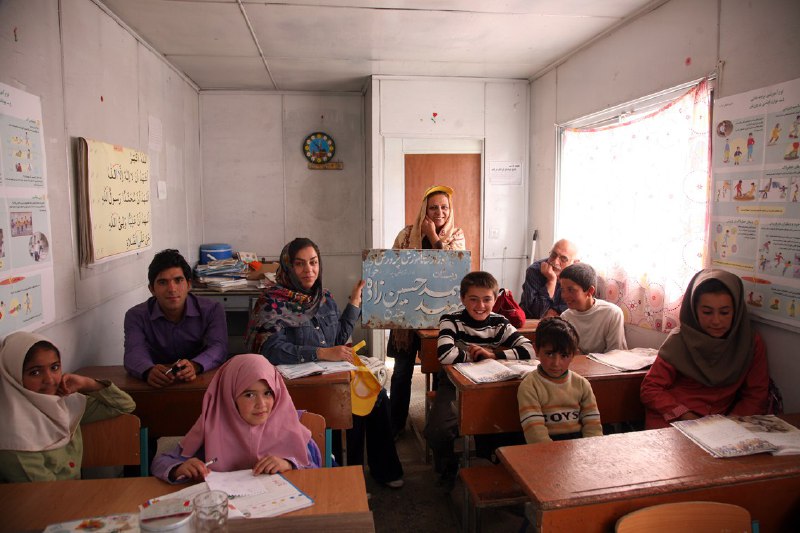
In order to click on artwork in this screenshot , I will do `click(405, 286)`.